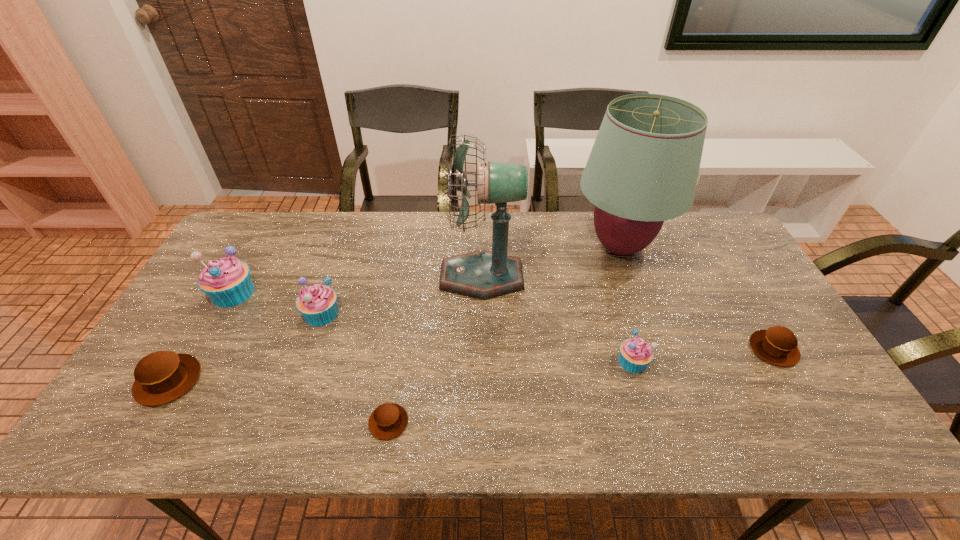
This screenshot has width=960, height=540. In order to click on the rightmost muffin in this screenshot , I will do `click(777, 345)`.

This screenshot has height=540, width=960. I want to click on the seventh tallest object, so [x=777, y=345].

Where is `the second brown muffin from left to right`? This screenshot has width=960, height=540. the second brown muffin from left to right is located at coordinates (389, 420).

Where is `the shortest object`? The width and height of the screenshot is (960, 540). the shortest object is located at coordinates (389, 420).

Where is `free space located on the left of the blue lampshade`? This screenshot has height=540, width=960. free space located on the left of the blue lampshade is located at coordinates (543, 246).

The width and height of the screenshot is (960, 540). Find the location of `free point located 0.400m in front of the blue fan where the wind blows`. free point located 0.400m in front of the blue fan where the wind blows is located at coordinates (310, 277).

The image size is (960, 540). Find the location of `free space located in front of the blue fan where the wind blows`. free space located in front of the blue fan where the wind blows is located at coordinates (401, 277).

Where is `free space located 0.370m in front of the blue fan where the wind blows`? The height and width of the screenshot is (540, 960). free space located 0.370m in front of the blue fan where the wind blows is located at coordinates (320, 277).

Locate an element on the screen. This screenshot has height=540, width=960. free region located on the back of the biggest blue muffin is located at coordinates (275, 218).

Locate an element on the screen. Image resolution: width=960 pixels, height=540 pixels. free space located on the right of the fifth shortest muffin is located at coordinates (362, 313).